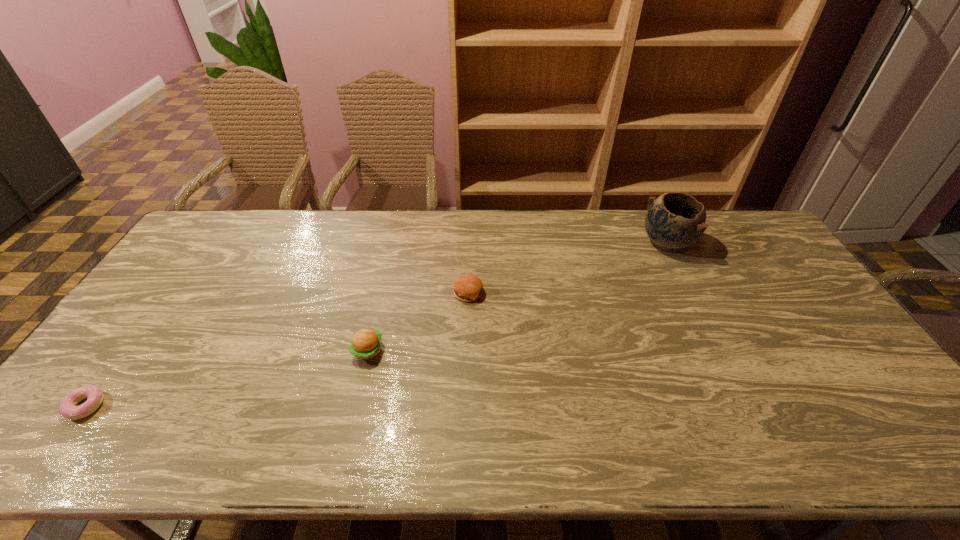
Locate which object is the closest to the second nearest object. Please provide its 2D coordinates. Your answer should be formatted as a tuple, i.e. [(x, y)], where the tuple contains the x and y coordinates of a point satisfying the conditions above.

[(467, 287)]

Point out which object is positioned as the third nearest to the left hamburger. Please provide its 2D coordinates. Your answer should be formatted as a tuple, i.e. [(x, y)], where the tuple contains the x and y coordinates of a point satisfying the conditions above.

[(675, 220)]

The image size is (960, 540). Identify the location of vacant area that satisfies the following two spatial constraints: 1. on the back side of the left hamburger; 2. on the left side of the shortest object. (126, 350).

Find the location of a particular element. The width and height of the screenshot is (960, 540). vacant region that satisfies the following two spatial constraints: 1. on the back side of the shorter hamburger; 2. on the right side of the leftmost object is located at coordinates (168, 293).